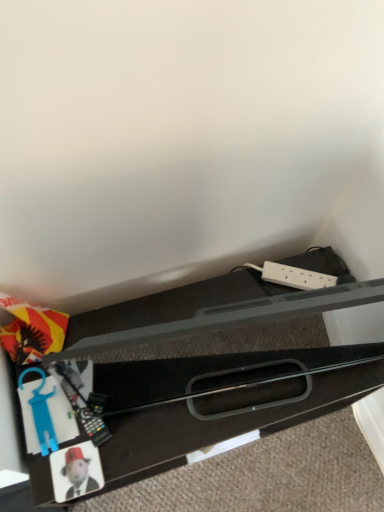
The width and height of the screenshot is (384, 512). What do you see at coordinates (77, 472) in the screenshot?
I see `matte plastic coaster at lower left, the 1th toy positioned from the bottom` at bounding box center [77, 472].

Image resolution: width=384 pixels, height=512 pixels. Describe the element at coordinates (41, 411) in the screenshot. I see `blue plastic toy at lower left, which appears as the second toy when ordered from the bottom` at that location.

Measure the distance between point [221,398] and camera.

They are 39.29 inches apart.

Where is `matte plastic coaster at lower left, the 1th toy positioned from the bottom`? The image size is (384, 512). matte plastic coaster at lower left, the 1th toy positioned from the bottom is located at coordinates (77, 472).

Is blue plastic toy at lower left, which appears as the second toy when ordered from the bottom, bigger than matte plastic coaster at lower left, the second toy viewed from the top?

Yes.

Measure the distance between blue plastic toy at lower left, marked as the first toy in a top-to-bottom arrangement, and matte plastic coaster at lower left, the second toy viewed from the top.

They are 4.10 inches apart.

Which object is positioned more to the right, blue plastic toy at lower left, marked as the first toy in a top-to-bottom arrangement, or matte plastic coaster at lower left, the 1th toy positioned from the bottom?

matte plastic coaster at lower left, the 1th toy positioned from the bottom.

Is blue plastic toy at lower left, marked as the first toy in a top-to-bottom arrangement, oriented towards matte plastic coaster at lower left, the second toy viewed from the top?

Yes, blue plastic toy at lower left, marked as the first toy in a top-to-bottom arrangement, is aimed at matte plastic coaster at lower left, the second toy viewed from the top.

Is point (349, 375) farther from viewer compared to point (38, 367)?

Yes, it is.

Would you consider black plastic drawer at lower left to be distant from blue plastic toy at lower left, which appears as the second toy when ordered from the bottom?

They are positioned close to each other.

From the image's perspective, relative to blue plastic toy at lower left, marked as the first toy in a top-to-bottom arrangement, is black plastic drawer at lower left above or below?

Based on their image positions, black plastic drawer at lower left is located above blue plastic toy at lower left, marked as the first toy in a top-to-bottom arrangement.

Is black plastic drawer at lower left positioned far away from matte plastic coaster at lower left, the second toy viewed from the top?

black plastic drawer at lower left is actually quite close to matte plastic coaster at lower left, the second toy viewed from the top.

Is black plastic drawer at lower left wider or thinner than matte plastic coaster at lower left, the 1th toy positioned from the bottom?

Clearly, black plastic drawer at lower left has more width compared to matte plastic coaster at lower left, the 1th toy positioned from the bottom.

From the image's perspective, between black plastic drawer at lower left and matte plastic coaster at lower left, the second toy viewed from the top, who is located below?

→ matte plastic coaster at lower left, the second toy viewed from the top, appears lower in the image.

Looking at their sizes, would you say matte plastic coaster at lower left, the second toy viewed from the top, is wider or thinner than black plastic drawer at lower left?

Clearly, matte plastic coaster at lower left, the second toy viewed from the top, has less width compared to black plastic drawer at lower left.

From a real-world perspective, is matte plastic coaster at lower left, the 1th toy positioned from the bottom, on black plastic drawer at lower left?

Yes, from a real-world perspective, matte plastic coaster at lower left, the 1th toy positioned from the bottom, is above black plastic drawer at lower left.

Is matte plastic coaster at lower left, the second toy viewed from the top, far away from black plastic drawer at lower left?

matte plastic coaster at lower left, the second toy viewed from the top, is near black plastic drawer at lower left, not far away.

Between matte plastic coaster at lower left, the second toy viewed from the top, and black plastic drawer at lower left, which one appears on the left side from the viewer's perspective?

matte plastic coaster at lower left, the second toy viewed from the top.

Is blue plastic toy at lower left, marked as the first toy in a top-to-bottom arrangement, oriented towards black plastic drawer at lower left?

Yes, blue plastic toy at lower left, marked as the first toy in a top-to-bottom arrangement, faces towards black plastic drawer at lower left.

Considering the sizes of blue plastic toy at lower left, which appears as the second toy when ordered from the bottom, and black plastic drawer at lower left in the image, is blue plastic toy at lower left, which appears as the second toy when ordered from the bottom, bigger or smaller than black plastic drawer at lower left?

Considering their sizes, blue plastic toy at lower left, which appears as the second toy when ordered from the bottom, takes up less space than black plastic drawer at lower left.

Is blue plastic toy at lower left, marked as the first toy in a top-to-bottom arrangement, far away from black plastic drawer at lower left?

No, blue plastic toy at lower left, marked as the first toy in a top-to-bottom arrangement, is not far away from black plastic drawer at lower left.

Between blue plastic toy at lower left, marked as the first toy in a top-to-bottom arrangement, and black plastic drawer at lower left, which one appears on the left side from the viewer's perspective?

Positioned to the left is blue plastic toy at lower left, marked as the first toy in a top-to-bottom arrangement.

From the image's perspective, relative to blue plastic toy at lower left, which appears as the second toy when ordered from the bottom, is matte plastic coaster at lower left, the second toy viewed from the top, above or below?

Clearly, from the image's perspective, matte plastic coaster at lower left, the second toy viewed from the top, is below blue plastic toy at lower left, which appears as the second toy when ordered from the bottom.

Which object is wider, matte plastic coaster at lower left, the 1th toy positioned from the bottom, or blue plastic toy at lower left, marked as the first toy in a top-to-bottom arrangement?

Wider between the two is blue plastic toy at lower left, marked as the first toy in a top-to-bottom arrangement.

How many degrees apart are the facing directions of matte plastic coaster at lower left, the second toy viewed from the top, and blue plastic toy at lower left, marked as the first toy in a top-to-bottom arrangement?

The angular difference between matte plastic coaster at lower left, the second toy viewed from the top, and blue plastic toy at lower left, marked as the first toy in a top-to-bottom arrangement, is 0.695 degrees.

Relative to blue plastic toy at lower left, which appears as the second toy when ordered from the bottom, is matte plastic coaster at lower left, the second toy viewed from the top, in front or behind?

matte plastic coaster at lower left, the second toy viewed from the top, is positioned closer to the viewer than blue plastic toy at lower left, which appears as the second toy when ordered from the bottom.

I want to click on toy below the blue plastic toy at lower left, which appears as the second toy when ordered from the bottom (from a real-world perspective), so click(77, 472).

The height and width of the screenshot is (512, 384). I want to click on furniture above the blue plastic toy at lower left, which appears as the second toy when ordered from the bottom (from the image's perspective), so click(x=216, y=401).

Based on their spatial positions, is matte plastic coaster at lower left, the second toy viewed from the top, or black plastic drawer at lower left closer to blue plastic toy at lower left, which appears as the second toy when ordered from the bottom?

Among the two, matte plastic coaster at lower left, the second toy viewed from the top, is located nearer to blue plastic toy at lower left, which appears as the second toy when ordered from the bottom.

From the image, which object appears to be farther from black plastic drawer at lower left, matte plastic coaster at lower left, the 1th toy positioned from the bottom, or blue plastic toy at lower left, which appears as the second toy when ordered from the bottom?

Based on the image, matte plastic coaster at lower left, the 1th toy positioned from the bottom, appears to be further to black plastic drawer at lower left.

From the image, which object appears to be nearer to black plastic drawer at lower left, blue plastic toy at lower left, which appears as the second toy when ordered from the bottom, or matte plastic coaster at lower left, the 1th toy positioned from the bottom?

Based on the image, blue plastic toy at lower left, which appears as the second toy when ordered from the bottom, appears to be nearer to black plastic drawer at lower left.

When comparing their distances from blue plastic toy at lower left, which appears as the second toy when ordered from the bottom, does black plastic drawer at lower left or matte plastic coaster at lower left, the 1th toy positioned from the bottom, seem closer?

Among the two, matte plastic coaster at lower left, the 1th toy positioned from the bottom, is located nearer to blue plastic toy at lower left, which appears as the second toy when ordered from the bottom.

Estimate the real-world distances between objects in this image. Which object is closer to matte plastic coaster at lower left, the second toy viewed from the top, black plastic drawer at lower left or blue plastic toy at lower left, which appears as the second toy when ordered from the bottom?

blue plastic toy at lower left, which appears as the second toy when ordered from the bottom.

Which object lies further to the anchor point matte plastic coaster at lower left, the 1th toy positioned from the bottom, blue plastic toy at lower left, marked as the first toy in a top-to-bottom arrangement, or black plastic drawer at lower left?

black plastic drawer at lower left lies further to matte plastic coaster at lower left, the 1th toy positioned from the bottom, than the other object.

Image resolution: width=384 pixels, height=512 pixels. I want to click on toy between blue plastic toy at lower left, marked as the first toy in a top-to-bottom arrangement, and black plastic drawer at lower left from left to right, so click(x=77, y=472).